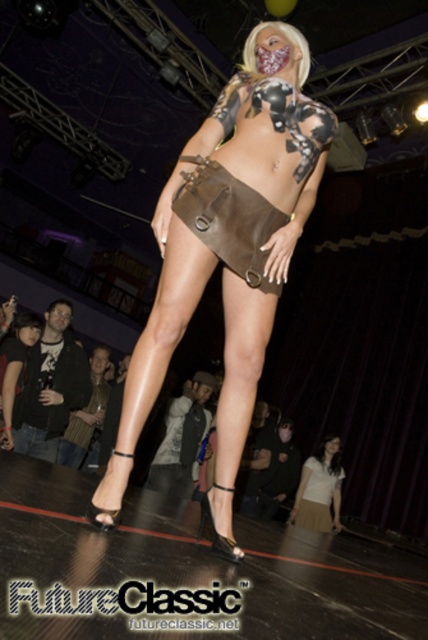
Question: Is matte brown leather skirt at center wider than white matte skirt at lower center?

Choices:
 (A) yes
 (B) no

Answer: (A)

Question: Which point is farther to the camera?

Choices:
 (A) (133, 420)
 (B) (294, 518)

Answer: (B)

Question: Which point is closer to the camera?

Choices:
 (A) matte brown leather skirt at center
 (B) white matte skirt at lower center

Answer: (A)

Question: Which point appears farthest from the camera in this image?

Choices:
 (A) (294, 522)
 (B) (202, 164)
 (C) (258, 156)

Answer: (A)

Question: Can you confirm if brown leather skirt at center is positioned to the right of white matte skirt at lower center?

Choices:
 (A) yes
 (B) no

Answer: (B)

Question: Is matte brown leather skirt at center to the left of white matte skirt at lower center from the viewer's perspective?

Choices:
 (A) yes
 (B) no

Answer: (A)